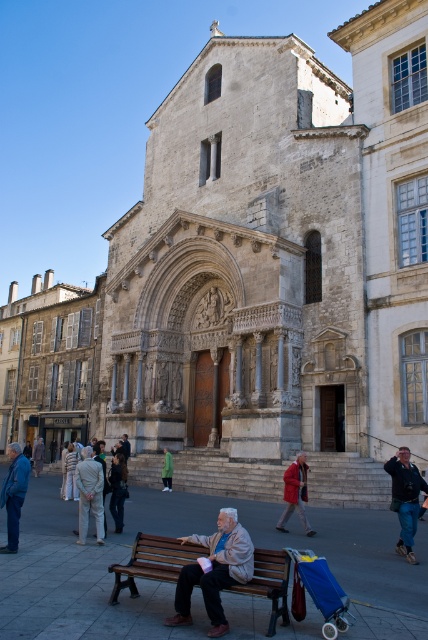
You are a photographer standing in the square in front of the historic stone church. You want to take a photo of the blue fabric stroller at lower right without the light brown leather jacket at lower center blocking the view. Is this possible?

The light brown leather jacket at lower center is further to the viewer than the blue fabric stroller at lower right, so it is blocking the stroller. To capture the stroller without obstruction, you would need to move to a position where the jacket is no longer in front of the stroller.

You are a photographer planning to capture the historic stone church with its Romanesque facade and the people in the square. You need to frame the scene so that the light brown leather jacket at lower center and the blue fabric stroller at lower right are both visible. Which object should you adjust your camera angle to prioritize if you want to include both without cropping either?

The light brown leather jacket at lower center is wider than the blue fabric stroller at lower right. To include both without cropping, prioritize framing the scene around the wider object, the light brown leather jacket at lower center, as it requires more space in the composition.